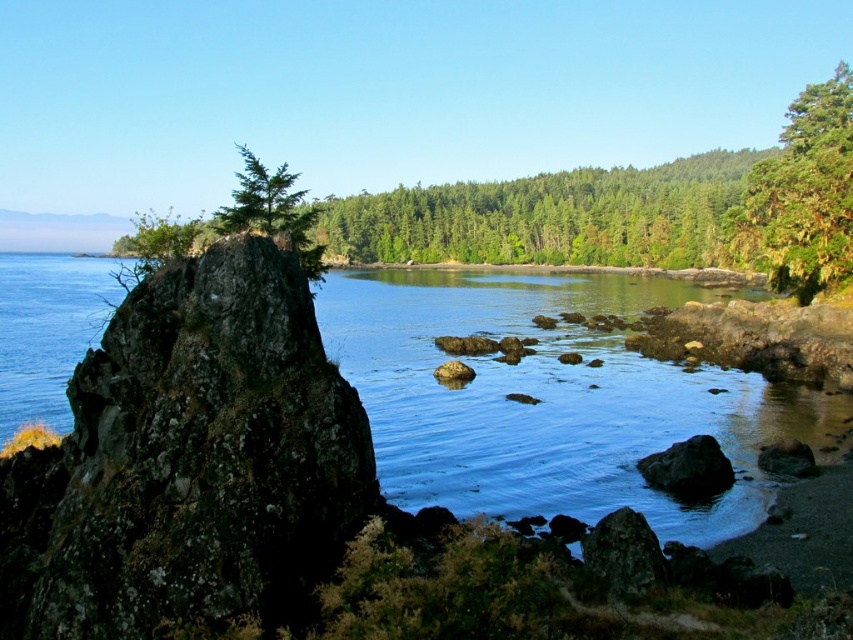
Question: Can you confirm if clear water at center is smaller than smooth gray rock at lower center?

Choices:
 (A) no
 (B) yes

Answer: (A)

Question: Among these objects, which one is farthest from the camera?

Choices:
 (A) dark gray rock at lower right
 (B) green matte tree at left
 (C) smooth gray rock at lower center

Answer: (A)

Question: Does smooth gray rock at lower center have a larger size compared to dark gray rock at lower right?

Choices:
 (A) yes
 (B) no

Answer: (B)

Question: Where is lichen-covered rock at left located in relation to dark gray rock at lower right in the image?

Choices:
 (A) right
 (B) left

Answer: (B)

Question: Which of the following is the farthest from the observer?

Choices:
 (A) smooth gray rock at center
 (B) green rough bark tree at upper right
 (C) clear water at center

Answer: (B)

Question: Which point is farther from the camera taking this photo?

Choices:
 (A) (778, 449)
 (B) (288, 230)

Answer: (A)